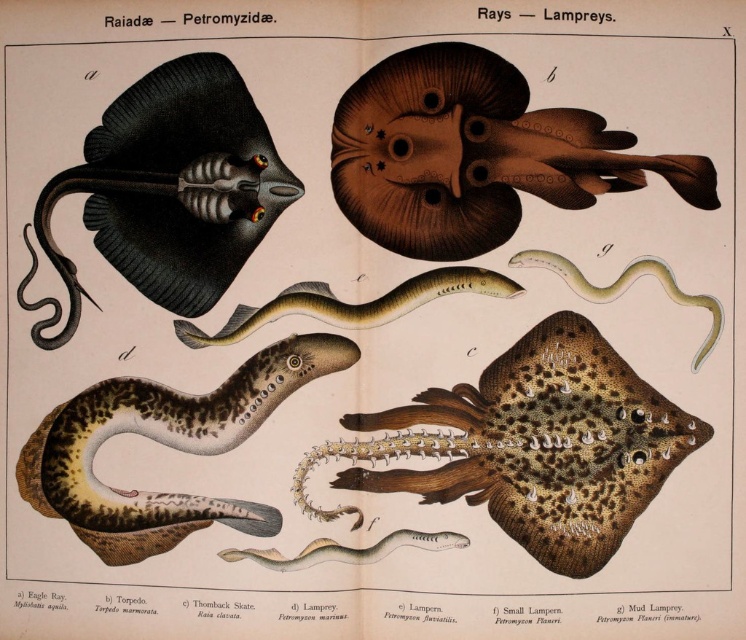
Question: Which of these objects is positioned farthest from the brown matte ray at upper center?

Choices:
 (A) black matte stingray at upper left
 (B) spotted brown skin at center
 (C) brown scaly torpedo at lower left

Answer: (C)

Question: Does black matte stingray at upper left appear on the right side of brown scaly torpedo at lower left?

Choices:
 (A) no
 (B) yes

Answer: (A)

Question: Does brown matte ray at upper center lie in front of brown scaly torpedo at lower left?

Choices:
 (A) no
 (B) yes

Answer: (B)

Question: Which point appears farthest from the camera in this image?

Choices:
 (A) (586, 131)
 (B) (295, 310)
 (C) (639, 426)

Answer: (B)

Question: Does yellow-green textured snake at center have a smaller size compared to green smooth snake at center?

Choices:
 (A) yes
 (B) no

Answer: (B)

Question: Which object is closer to the camera taking this photo?

Choices:
 (A) green smooth snake at center
 (B) brown scaly torpedo at lower left
 (C) brown matte ray at upper center
 (D) spotted brown skin at center

Answer: (D)